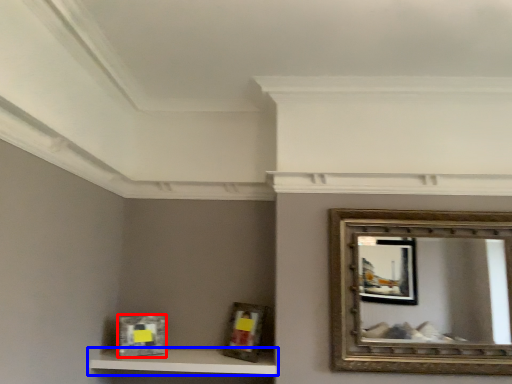
Question: Which object appears farthest to the camera in this image, picture frame (highlighted by a red box) or shelf (highlighted by a blue box)?

Choices:
 (A) picture frame
 (B) shelf

Answer: (A)